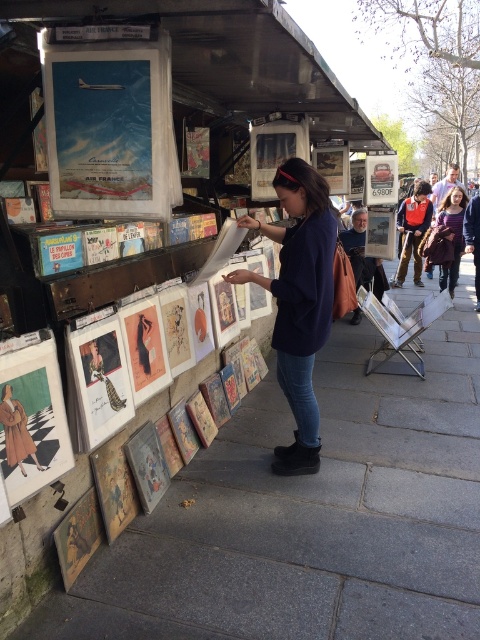
You are standing at the position of the woman in the scene. If you look towards the point at (440,275), will the point at (283,380) block your view of it?

Point (283,380) is in front of point (440,275), so yes, the point at (283,380) would block your view of the point at (440,275).